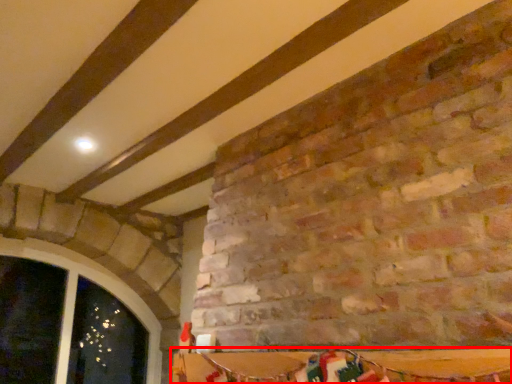
Question: From the image's perspective, considering the relative positions of table (annotated by the red box) and window in the image provided, where is table (annotated by the red box) located with respect to the staircase?

Choices:
 (A) above
 (B) below

Answer: (A)